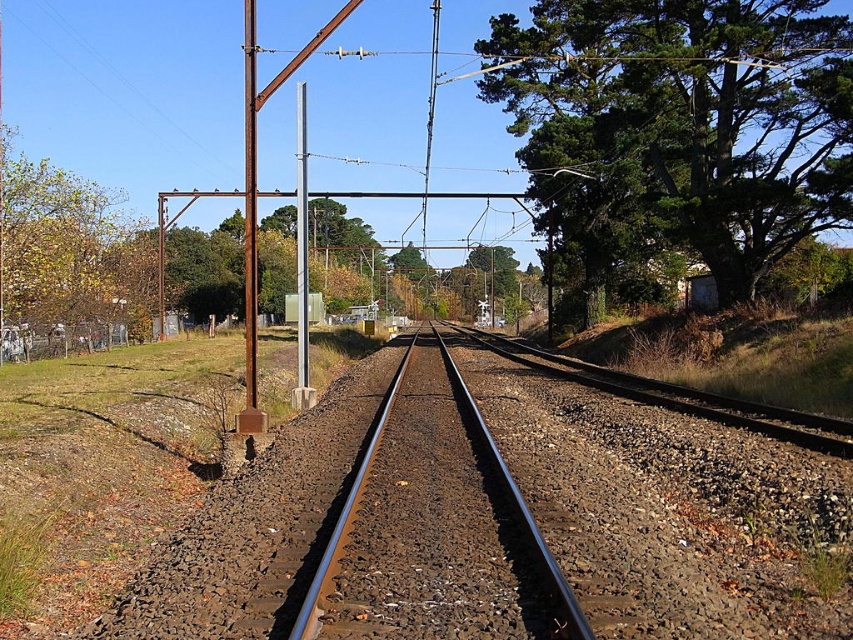
Does smooth steel tracks at center appear over metallic pole at center?

No, smooth steel tracks at center is not above metallic pole at center.

Who is shorter, smooth steel tracks at center or metallic pole at center?

smooth steel tracks at center is shorter.

Is point (310, 586) closer to viewer compared to point (299, 147)?

Yes, it is.

Image resolution: width=853 pixels, height=640 pixels. What are the coordinates of `smooth steel tracks at center` in the screenshot? It's located at (434, 529).

Does green leafy tree at upper right have a larger size compared to metallic pole at center?

No.

Who is shorter, green leafy tree at upper right or metallic pole at center?

With less height is green leafy tree at upper right.

What do you see at coordinates (682, 124) in the screenshot? I see `green leafy tree at upper right` at bounding box center [682, 124].

Find the location of a particular element. This screenshot has height=640, width=853. green leafy tree at upper right is located at coordinates (682, 124).

Can you confirm if green leafy tree at upper right is wider than smooth steel tracks at center?

→ Indeed, green leafy tree at upper right has a greater width compared to smooth steel tracks at center.

Is green leafy tree at upper right positioned behind smooth steel tracks at center?

Yes, green leafy tree at upper right is behind smooth steel tracks at center.

Is point (689, 138) positioned before point (387, 518)?

No, (689, 138) is behind (387, 518).

Find the location of a particular element. This screenshot has width=853, height=640. green leafy tree at upper right is located at coordinates (682, 124).